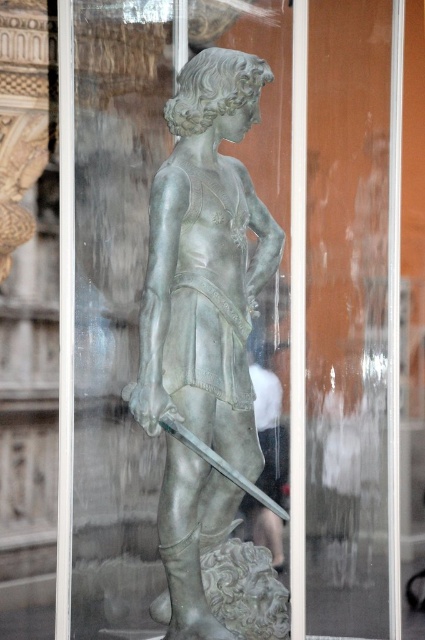
You are a museum curator planning to move the shiny bronze statue at center and the polished silver sword at center to a new exhibition space. The new space has a height restriction of 2 meters. Can both items be moved without any modifications?

The shiny bronze statue at center is taller than the polished silver sword at center. Since the statue is the taller item and its exact height isn not provided, it might exceed the 2 meter restriction. Further measurements are needed to confirm.

You are a security guard in a museum. You notice the shiny bronze statue at center and the polished silver sword at center. Which object is closer to you as you stand in front of the display case?

The shiny bronze statue at center is closer to you since it is in front of the polished silver sword at center.

You are standing in front of the glass display case containing the bronze statue. There are two points marked on the case at coordinates point (x=155, y=326) and point (x=170, y=422). Which point is closer to you as you face the display case?

Point (x=170, y=422) is closer to you because it is in front of point (x=155, y=326).